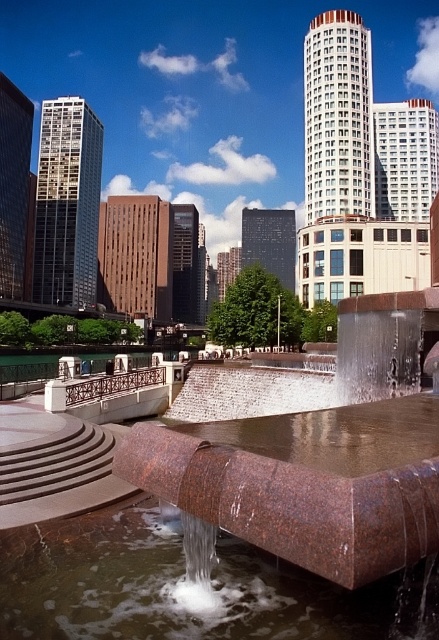
You are a city planner evaluating the space in front of the rustic stone fountain at center and brown granite water at center. Which object takes up more space in the scene?

The rustic stone fountain at center is bigger than brown granite water at center, so it takes up more space in the scene.

You are a tourist standing in front of the rustic stone fountain at center and the brown granite water at center. Which object is located to the left of the other?

The brown granite water at center is located to the left of the rustic stone fountain at center because the rustic stone fountain at center is positioned on the right side of brown granite water at center.